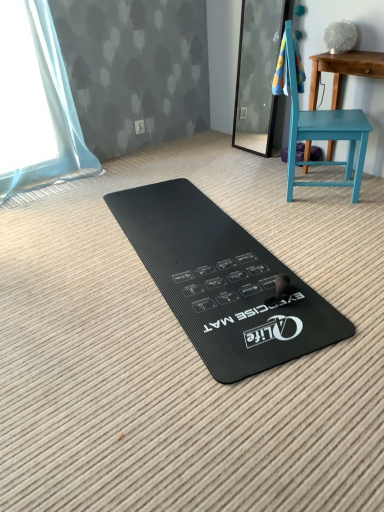
What is the approximate height of teal painted wood table at right?

teal painted wood table at right is 29.70 inches tall.

The width and height of the screenshot is (384, 512). Find the location of `teal painted wood table at right`. teal painted wood table at right is located at coordinates (343, 71).

What is the approximate width of blue textured towel at upper right?

blue textured towel at upper right is 7.04 inches in width.

What do you see at coordinates (281, 71) in the screenshot?
I see `blue textured towel at upper right` at bounding box center [281, 71].

What do you see at coordinates (222, 282) in the screenshot? I see `black rubber exercise mat at center` at bounding box center [222, 282].

The height and width of the screenshot is (512, 384). What are the coordinates of `teal painted wood table at right` in the screenshot? It's located at (343, 71).

Can you tell me how much teal painted wood table at right and black rubber exercise mat at center differ in facing direction?

75 degrees separate the facing orientations of teal painted wood table at right and black rubber exercise mat at center.

Would you consider teal painted wood table at right to be distant from black rubber exercise mat at center?

Indeed, teal painted wood table at right is not near black rubber exercise mat at center.

Relative to black rubber exercise mat at center, is teal painted wood table at right in front or behind?

Clearly, teal painted wood table at right is behind black rubber exercise mat at center.

Is teal painted wood table at right not within black rubber exercise mat at center?

Absolutely, teal painted wood table at right is external to black rubber exercise mat at center.

What are the coordinates of `beach towel on the left of teal matte chair at right` in the screenshot? It's located at (281, 71).

Which point is more distant from viewer, (280, 60) or (325, 124)?

The point (325, 124) is farther from the camera.

Is teal matte chair at right at the back of blue textured towel at upper right?

Yes, blue textured towel at upper right is facing away from teal matte chair at right.

Looking at their sizes, would you say blue textured towel at upper right is wider or thinner than teal matte chair at right?

In the image, blue textured towel at upper right appears to be more narrow than teal matte chair at right.

Which is behind, point (279, 92) or point (333, 70)?

Point (333, 70)

Considering the relative positions of blue textured towel at upper right and teal painted wood table at right in the image provided, is blue textured towel at upper right to the left of teal painted wood table at right from the viewer's perspective?

Indeed, blue textured towel at upper right is positioned on the left side of teal painted wood table at right.

Is blue textured towel at upper right facing towards teal painted wood table at right?

No, blue textured towel at upper right is not facing towards teal painted wood table at right.

From a real-world perspective, is blue textured towel at upper right physically below teal painted wood table at right?

No, from a real-world perspective, blue textured towel at upper right is not below teal painted wood table at right.

Identify the location of chair above the teal painted wood table at right (from the image's perspective). (323, 133).

Is teal painted wood table at right inside the boundaries of teal matte chair at right, or outside?

teal painted wood table at right cannot be found inside teal matte chair at right.

Considering the sizes of objects teal painted wood table at right and teal matte chair at right in the image provided, who is thinner, teal painted wood table at right or teal matte chair at right?

Thinner between the two is teal painted wood table at right.

From the picture: Who is bigger, teal painted wood table at right or teal matte chair at right?

teal matte chair at right.

From a real-world perspective, is teal matte chair at right physically located above or below blue textured towel at upper right?

teal matte chair at right is situated lower than blue textured towel at upper right in the real world.

Is teal matte chair at right inside the boundaries of blue textured towel at upper right, or outside?

teal matte chair at right lies outside blue textured towel at upper right.

Who is shorter, teal matte chair at right or black rubber exercise mat at center?

black rubber exercise mat at center.

Is teal matte chair at right turned away from black rubber exercise mat at center?

No, teal matte chair at right's orientation is not away from black rubber exercise mat at center.

Where is `chair lying above the black rubber exercise mat at center (from the image's perspective)`? chair lying above the black rubber exercise mat at center (from the image's perspective) is located at coordinates (x=323, y=133).

From a real-world perspective, does teal matte chair at right stand above black rubber exercise mat at center?

Indeed, from a real-world perspective, teal matte chair at right stands above black rubber exercise mat at center.

Considering the relative positions of teal painted wood table at right and blue textured towel at upper right in the image provided, is teal painted wood table at right to the left of blue textured towel at upper right from the viewer's perspective?

No, teal painted wood table at right is not to the left of blue textured towel at upper right.

Is teal painted wood table at right spatially inside blue textured towel at upper right, or outside of it?

teal painted wood table at right lies outside blue textured towel at upper right.

From the image's perspective, is teal painted wood table at right located above blue textured towel at upper right?

No, from the image's perspective, teal painted wood table at right is not above blue textured towel at upper right.

From a real-world perspective, which is physically below, teal painted wood table at right or blue textured towel at upper right?

From a 3D spatial view, teal painted wood table at right is below.

The height and width of the screenshot is (512, 384). I want to click on yoga mat that appears below the teal painted wood table at right (from a real-world perspective), so click(222, 282).

Identify the location of beach towel above the teal matte chair at right (from a real-world perspective). The image size is (384, 512). point(281,71).

Looking at the image, which one is located closer to black rubber exercise mat at center, teal painted wood table at right or teal matte chair at right?

Among the two, teal matte chair at right is located nearer to black rubber exercise mat at center.

Based on their spatial positions, is black rubber exercise mat at center or teal matte chair at right closer to blue textured towel at upper right?

teal matte chair at right.

Considering their positions, is blue textured towel at upper right positioned further to teal matte chair at right than black rubber exercise mat at center?

Based on the image, black rubber exercise mat at center appears to be further to teal matte chair at right.

Which object lies further to the anchor point black rubber exercise mat at center, teal matte chair at right or teal painted wood table at right?

Based on the image, teal painted wood table at right appears to be further to black rubber exercise mat at center.

From the image, which object appears to be nearer to blue textured towel at upper right, teal painted wood table at right or teal matte chair at right?

Among the two, teal painted wood table at right is located nearer to blue textured towel at upper right.

Looking at the image, which one is located further to black rubber exercise mat at center, teal painted wood table at right or blue textured towel at upper right?

teal painted wood table at right is positioned further to the anchor black rubber exercise mat at center.

From the image, which object appears to be farther from blue textured towel at upper right, black rubber exercise mat at center or teal painted wood table at right?

black rubber exercise mat at center is further to blue textured towel at upper right.

Which object lies further to the anchor point teal matte chair at right, black rubber exercise mat at center or blue textured towel at upper right?

Among the two, black rubber exercise mat at center is located further to teal matte chair at right.

Where is `table that lies between blue textured towel at upper right and black rubber exercise mat at center from top to bottom`? The width and height of the screenshot is (384, 512). table that lies between blue textured towel at upper right and black rubber exercise mat at center from top to bottom is located at coordinates (343, 71).

This screenshot has width=384, height=512. I want to click on chair between blue textured towel at upper right and teal painted wood table at right from left to right, so click(323, 133).

You are a GUI agent. You are given a task and a screenshot of the screen. Output one action in this format:
    pyautogui.click(x=<x>, y=<y>)
    Task: Click on the chair between black rubber exercise mat at center and teal painted wood table at right
    This screenshot has height=512, width=384.
    Given the screenshot: What is the action you would take?
    pyautogui.click(x=323, y=133)

Locate an element on the screen. chair between blue textured towel at upper right and black rubber exercise mat at center from top to bottom is located at coordinates (323, 133).